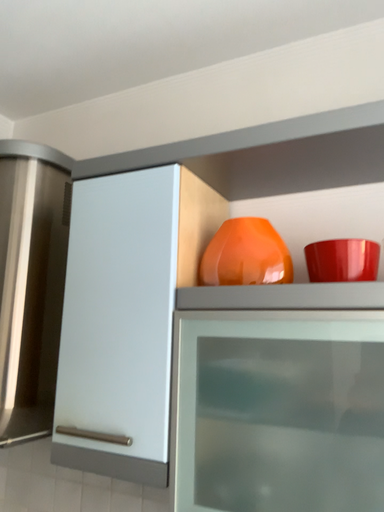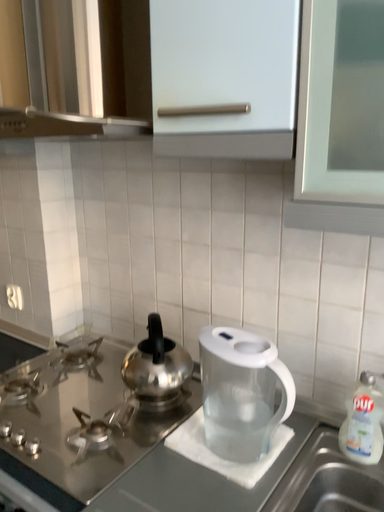
Question: Which way did the camera rotate in the video?

Choices:
 (A) rotated upward
 (B) rotated downward

Answer: (B)